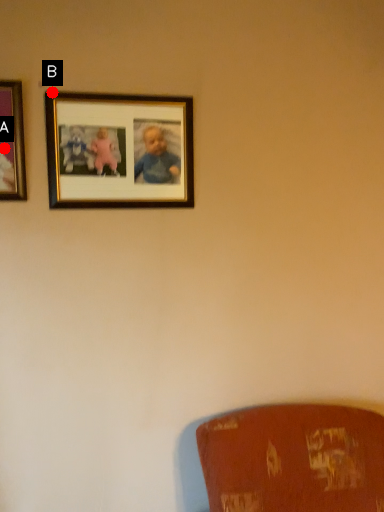
Question: Two points are circled on the image, labeled by A and B beside each circle. Which of the following is the closest to the observer?

Choices:
 (A) A is closer
 (B) B is closer

Answer: (A)